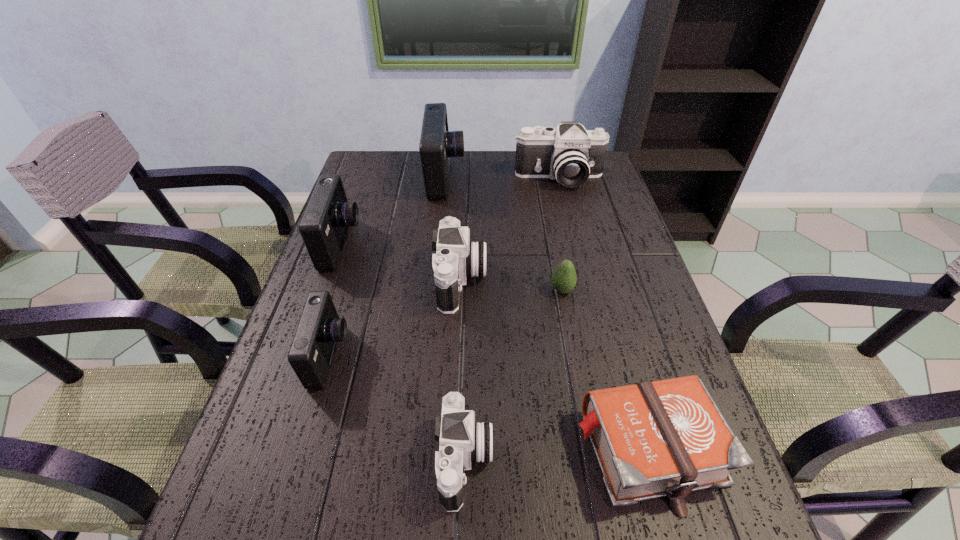
In order to click on camera situated at the right edge in this screenshot , I will do `click(570, 154)`.

I want to click on Bible at the right edge, so tap(667, 438).

At what (x,y) coordinates should I click in order to perform the action: click on object positioned at the far right corner. Please return your answer as a coordinate pair (x, y). This screenshot has width=960, height=540. Looking at the image, I should click on (570, 154).

Find the location of `vacant space at the far edge of the desktop`. vacant space at the far edge of the desktop is located at coordinates (491, 153).

Find the location of `vacant space at the right edge of the desktop`. vacant space at the right edge of the desktop is located at coordinates (595, 197).

Find the location of a particular element. free space at the far left corner is located at coordinates (379, 163).

The width and height of the screenshot is (960, 540). I want to click on free region at the near left corner of the desktop, so click(212, 539).

Where is `free area in between the second smallest blue camera and the Bible`? The height and width of the screenshot is (540, 960). free area in between the second smallest blue camera and the Bible is located at coordinates (495, 347).

I want to click on free area in between the biggest blue camera and the smallest blue camera, so click(388, 267).

Image resolution: width=960 pixels, height=540 pixels. Identify the location of vacant point located between the nearest camera and the green avocado. (514, 375).